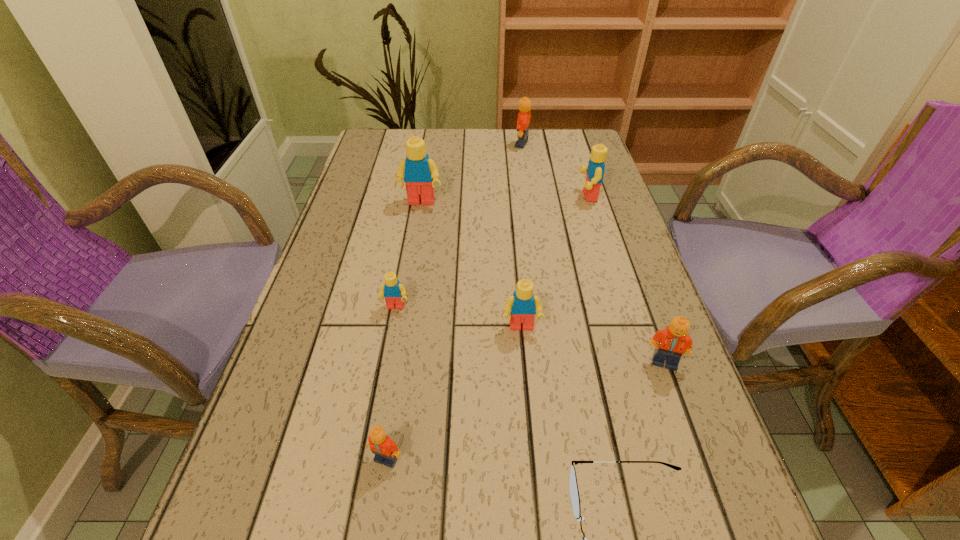
The height and width of the screenshot is (540, 960). What are the coordinates of `the nearest Lego` in the screenshot? It's located at (386, 452).

Find the location of `the fourth farthest Lego`. the fourth farthest Lego is located at coordinates (394, 293).

Where is `the smallest yellow Lego`? The width and height of the screenshot is (960, 540). the smallest yellow Lego is located at coordinates (394, 293).

This screenshot has width=960, height=540. I want to click on vacant space located on the front-facing side of the tallest Lego, so click(402, 316).

Where is `vacant space positioned on the front-facing side of the biggest orange Lego`? The image size is (960, 540). vacant space positioned on the front-facing side of the biggest orange Lego is located at coordinates [465, 144].

Where is `vacant space located 0.080m on the front-facing side of the biggest orange Lego`? This screenshot has width=960, height=540. vacant space located 0.080m on the front-facing side of the biggest orange Lego is located at coordinates (490, 144).

Identify the location of vacant space located 0.170m on the front-facing side of the biggest orange Lego. (462, 144).

Identify the location of free space located on the front-facing side of the rightmost yellow Lego. The width and height of the screenshot is (960, 540). (513, 196).

Locate an element on the screen. This screenshot has width=960, height=540. vacant space located 0.360m on the front-facing side of the rightmost yellow Lego is located at coordinates (446, 196).

I want to click on free space located on the front-facing side of the rightmost yellow Lego, so click(465, 196).